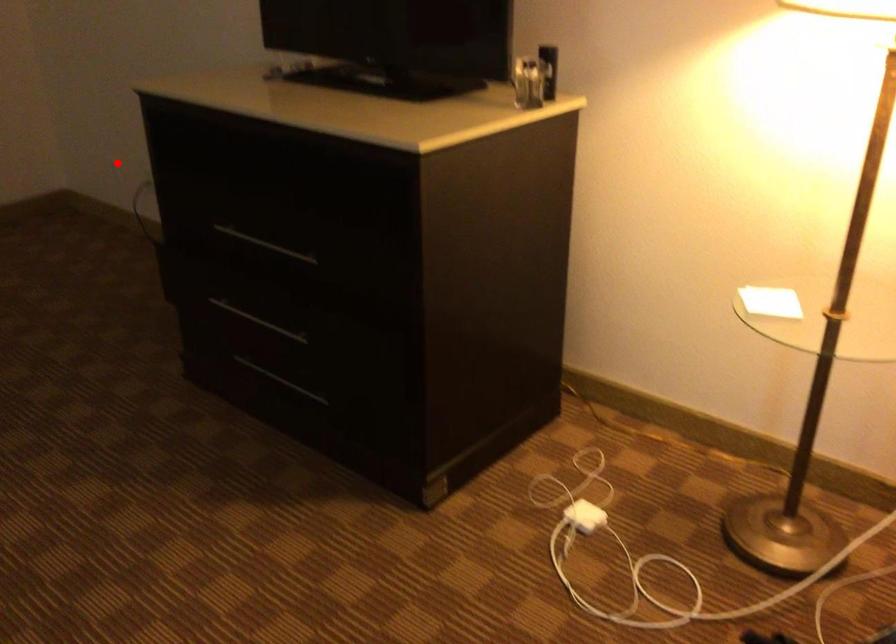
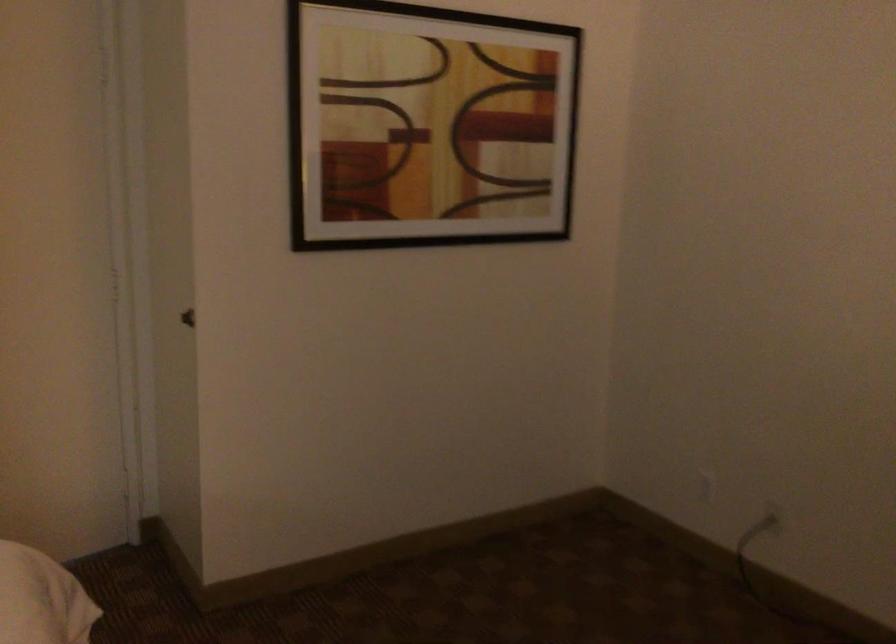
Where in the second image is the point corresponding to the highlighted location from the first image?

(707, 487)